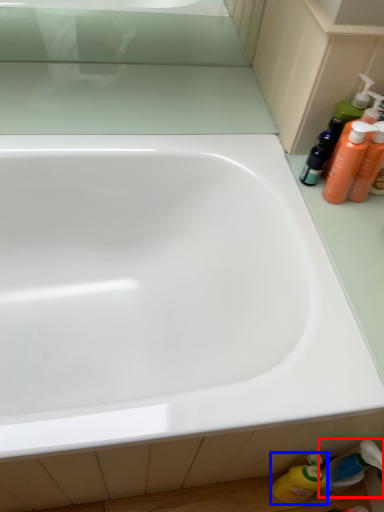
Question: Which point is closer to the camera, toiletry (highlighted by a red box) or cleaning product (highlighted by a blue box)?

Choices:
 (A) toiletry
 (B) cleaning product

Answer: (A)